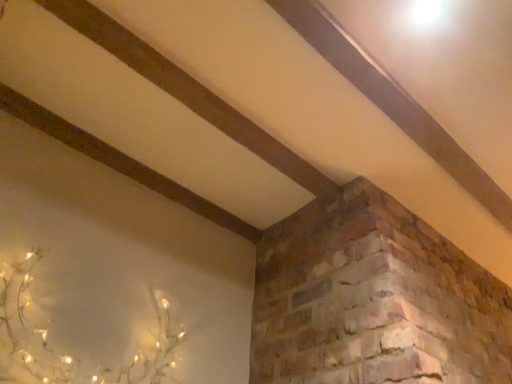
This screenshot has width=512, height=384. I want to click on ivory matte plant at lower left, so click(67, 354).

What do you see at coordinates (67, 354) in the screenshot?
I see `ivory matte plant at lower left` at bounding box center [67, 354].

This screenshot has height=384, width=512. Find the location of `smooth wooden plank at upper center`. smooth wooden plank at upper center is located at coordinates (393, 101).

Describe the element at coordinates (393, 101) in the screenshot. Image resolution: width=512 pixels, height=384 pixels. I see `smooth wooden plank at upper center` at that location.

Where is `ivory matte plant at lower left`? The width and height of the screenshot is (512, 384). ivory matte plant at lower left is located at coordinates (67, 354).

Is smooth wooden plank at upper center to the left of ivory matte plant at lower left from the viewer's perspective?

No, smooth wooden plank at upper center is not to the left of ivory matte plant at lower left.

Between smooth wooden plank at upper center and ivory matte plant at lower left, which one is positioned behind?

smooth wooden plank at upper center is further away from the camera.

Does point (395, 107) come behind point (7, 340)?

Yes, it is.

From the image's perspective, is smooth wooden plank at upper center above ivory matte plant at lower left?

Correct, smooth wooden plank at upper center appears higher than ivory matte plant at lower left in the image.

In the scene shown: From a real-world perspective, which is physically above, smooth wooden plank at upper center or ivory matte plant at lower left?

From a 3D spatial view, smooth wooden plank at upper center is above.

Does smooth wooden plank at upper center have a lesser width compared to ivory matte plant at lower left?

Indeed, smooth wooden plank at upper center has a lesser width compared to ivory matte plant at lower left.

Which of these two, smooth wooden plank at upper center or ivory matte plant at lower left, stands taller?

With more height is ivory matte plant at lower left.

Is smooth wooden plank at upper center smaller than ivory matte plant at lower left?

Indeed, smooth wooden plank at upper center has a smaller size compared to ivory matte plant at lower left.

From the picture: Does smooth wooden plank at upper center contain ivory matte plant at lower left?

No, ivory matte plant at lower left is not inside smooth wooden plank at upper center.

Are smooth wooden plank at upper center and ivory matte plant at lower left far apart?

Yes.

Is smooth wooden plank at upper center facing away from ivory matte plant at lower left?

No, smooth wooden plank at upper center is not facing away from ivory matte plant at lower left.

What's the angular difference between smooth wooden plank at upper center and ivory matte plant at lower left's facing directions?

smooth wooden plank at upper center and ivory matte plant at lower left are facing 0.0932 degrees away from each other.

Measure the distance between smooth wooden plank at upper center and ivory matte plant at lower left.

smooth wooden plank at upper center and ivory matte plant at lower left are 1.17 meters apart.

This screenshot has width=512, height=384. In order to click on plank above the ivory matte plant at lower left (from the image's perspective) in this screenshot , I will do `click(393, 101)`.

Considering the positions of objects ivory matte plant at lower left and smooth wooden plank at upper center in the image provided, who is more to the left, ivory matte plant at lower left or smooth wooden plank at upper center?

Positioned to the left is ivory matte plant at lower left.

Is the depth of ivory matte plant at lower left greater than that of smooth wooden plank at upper center?

No, ivory matte plant at lower left is closer to the viewer.

Between point (169, 339) and point (470, 164), which one is positioned behind?

The point (470, 164) is farther.

From the image's perspective, is ivory matte plant at lower left located above or below smooth wooden plank at upper center?

From the image's perspective, ivory matte plant at lower left appears below smooth wooden plank at upper center.

From a real-world perspective, is ivory matte plant at lower left over smooth wooden plank at upper center?

No, from a real-world perspective, ivory matte plant at lower left is not above smooth wooden plank at upper center.

Does ivory matte plant at lower left have a greater width compared to smooth wooden plank at upper center?

Yes.

Considering the relative sizes of ivory matte plant at lower left and smooth wooden plank at upper center in the image provided, is ivory matte plant at lower left taller than smooth wooden plank at upper center?

Indeed, ivory matte plant at lower left has a greater height compared to smooth wooden plank at upper center.

Can you confirm if ivory matte plant at lower left is bigger than smooth wooden plank at upper center?

Correct, ivory matte plant at lower left is larger in size than smooth wooden plank at upper center.

Is smooth wooden plank at upper center located within ivory matte plant at lower left?

Actually, smooth wooden plank at upper center is outside ivory matte plant at lower left.

Are ivory matte plant at lower left and smooth wooden plank at upper center far apart?

Yes, ivory matte plant at lower left is far from smooth wooden plank at upper center.

Is ivory matte plant at lower left turned away from smooth wooden plank at upper center?

ivory matte plant at lower left is not turned away from smooth wooden plank at upper center.

Can you tell me how much ivory matte plant at lower left and smooth wooden plank at upper center differ in facing direction?

0.0932 degrees.

How distant is ivory matte plant at lower left from smooth wooden plank at upper center?

1.17 meters.

Identify the location of plant below the smooth wooden plank at upper center (from a real-world perspective). (67, 354).

The image size is (512, 384). Identify the location of plant lying on the left of smooth wooden plank at upper center. (67, 354).

Where is `plank behind the ivory matte plant at lower left`? This screenshot has width=512, height=384. plank behind the ivory matte plant at lower left is located at coordinates (393, 101).